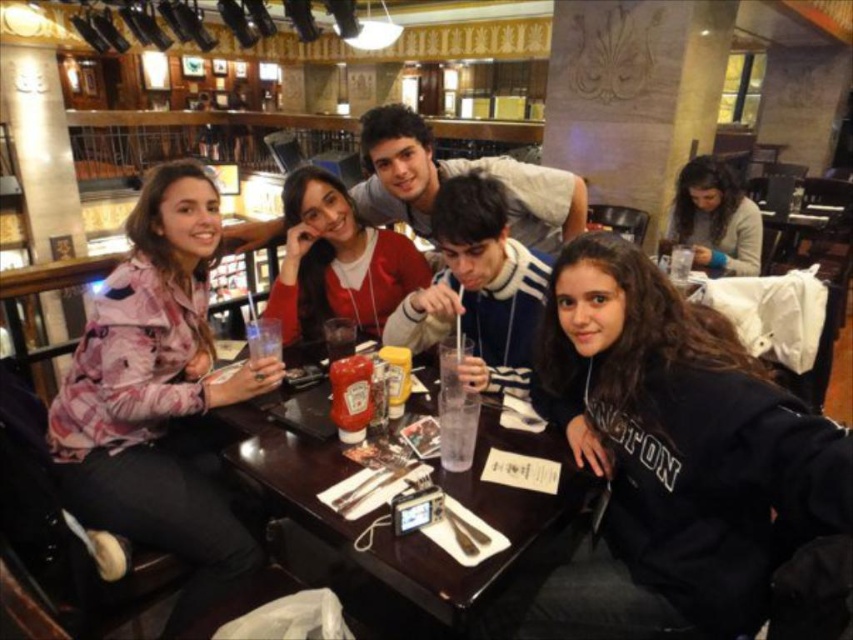
Question: Among these objects, which one is farthest from the camera?

Choices:
 (A) matte red sweater at center
 (B) clear glass water at table center
 (C) clear glass at center

Answer: (A)

Question: Which point is closer to the camera?

Choices:
 (A) blue fleece jacket at center
 (B) clear glass at center
 (C) translucent plastic cup at center
 (D) black matte sweatshirt at lower right

Answer: (D)

Question: Can you confirm if wooden table at center is positioned above blue fleece jacket at center?

Choices:
 (A) no
 (B) yes

Answer: (A)

Question: Does wooden table at center lie in front of clear glass at center?

Choices:
 (A) yes
 (B) no

Answer: (A)

Question: Can you confirm if dark brown hair at upper right is thinner than clear plastic cup at table center?

Choices:
 (A) no
 (B) yes

Answer: (A)

Question: Which point is farther to the camera?

Choices:
 (A) floral-patterned jacket at left
 (B) blue fleece jacket at center
 (C) dark brown hair at upper right
 (D) clear glass at center

Answer: (C)